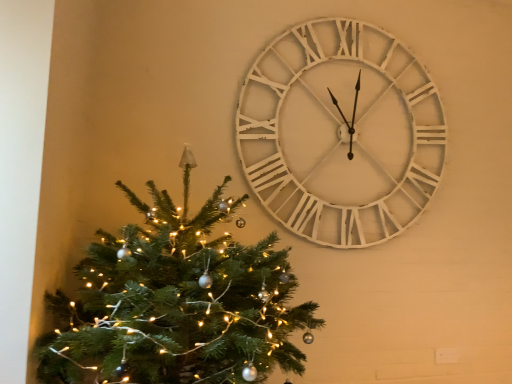
Question: From a real-world perspective, is white wooden clock at upper right positioned above or below green matte christmas tree at left?

Choices:
 (A) above
 (B) below

Answer: (A)

Question: Would you say white wooden clock at upper right is to the left or to the right of green matte christmas tree at left in the picture?

Choices:
 (A) right
 (B) left

Answer: (A)

Question: In terms of size, does white wooden clock at upper right appear bigger or smaller than green matte christmas tree at left?

Choices:
 (A) big
 (B) small

Answer: (B)

Question: Is green matte christmas tree at left to the left or to the right of white wooden clock at upper right in the image?

Choices:
 (A) left
 (B) right

Answer: (A)

Question: Considering the positions of point (257, 311) and point (311, 31), is point (257, 311) closer or farther from the camera than point (311, 31)?

Choices:
 (A) closer
 (B) farther

Answer: (A)

Question: In terms of width, does green matte christmas tree at left look wider or thinner when compared to white wooden clock at upper right?

Choices:
 (A) wide
 (B) thin

Answer: (A)

Question: Choose the correct answer: Is green matte christmas tree at left inside white wooden clock at upper right or outside it?

Choices:
 (A) outside
 (B) inside

Answer: (A)